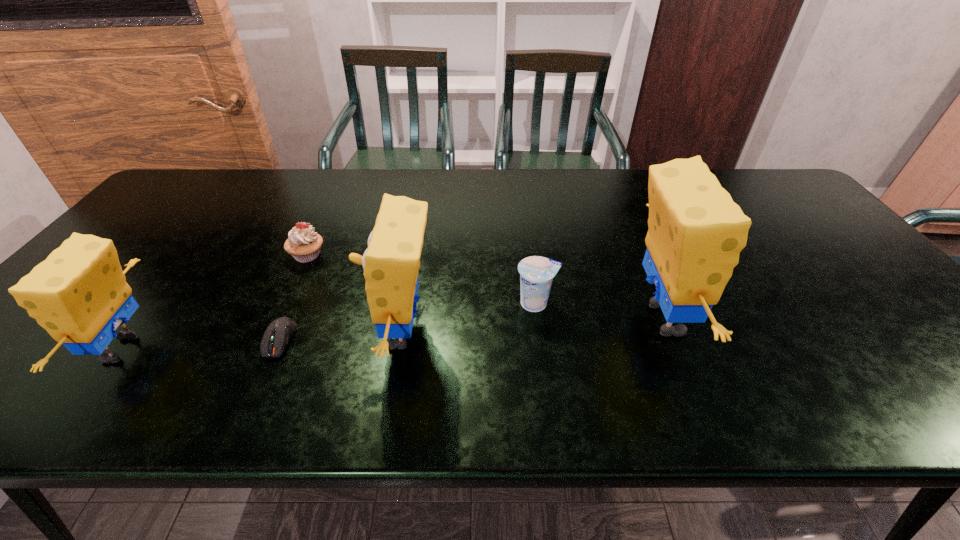
At what (x,y) coordinates should I click in order to perform the action: click on vacant space at the left edge of the desktop. Please return your answer as a coordinate pair (x, y). The height and width of the screenshot is (540, 960). Looking at the image, I should click on (151, 240).

In the image, there is a desktop. At what (x,y) coordinates should I click in order to perform the action: click on vacant space at the right edge. Please return your answer as a coordinate pair (x, y). The height and width of the screenshot is (540, 960). Looking at the image, I should click on (848, 304).

The width and height of the screenshot is (960, 540). Identify the location of free space at the far right corner. (757, 202).

In the image, there is a desktop. Where is `vacant space at the near right corner`? vacant space at the near right corner is located at coordinates [x=904, y=360].

Find the location of a particular element. vacant area between the fourth object from left to right and the fifth object from left to right is located at coordinates (468, 319).

Identify the location of empty space between the shortest object and the fourth object from left to right. (341, 336).

This screenshot has width=960, height=540. Find the location of `vacant space that's between the second shortest sponge and the computer equipment`. vacant space that's between the second shortest sponge and the computer equipment is located at coordinates (341, 336).

Identify the location of empty space between the second sponge from left to right and the shortest object. (341, 336).

Where is `free area in between the cupcake and the second tallest sponge`? free area in between the cupcake and the second tallest sponge is located at coordinates (354, 294).

Find the location of a particular element. The height and width of the screenshot is (540, 960). vacant point located between the fifth object from left to right and the rightmost sponge is located at coordinates (600, 311).